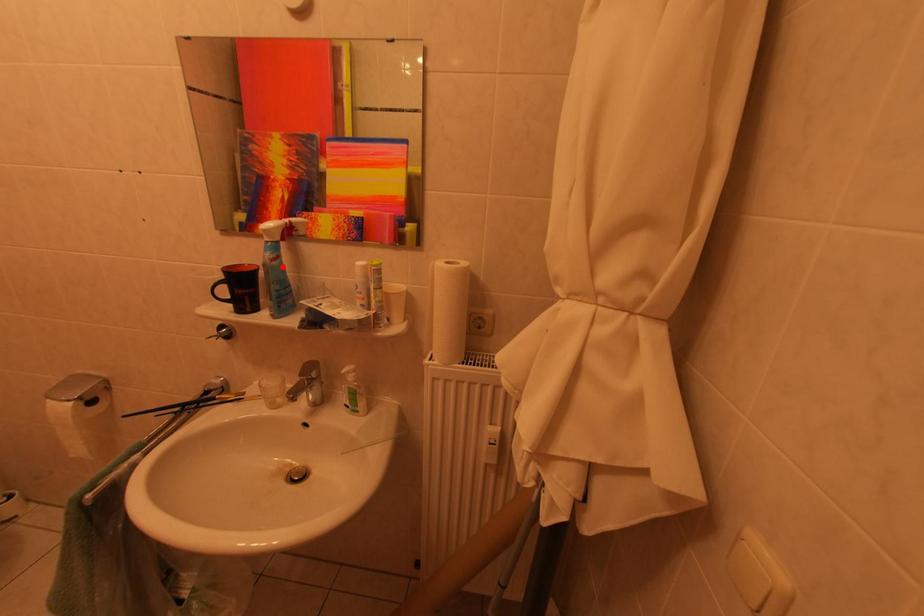
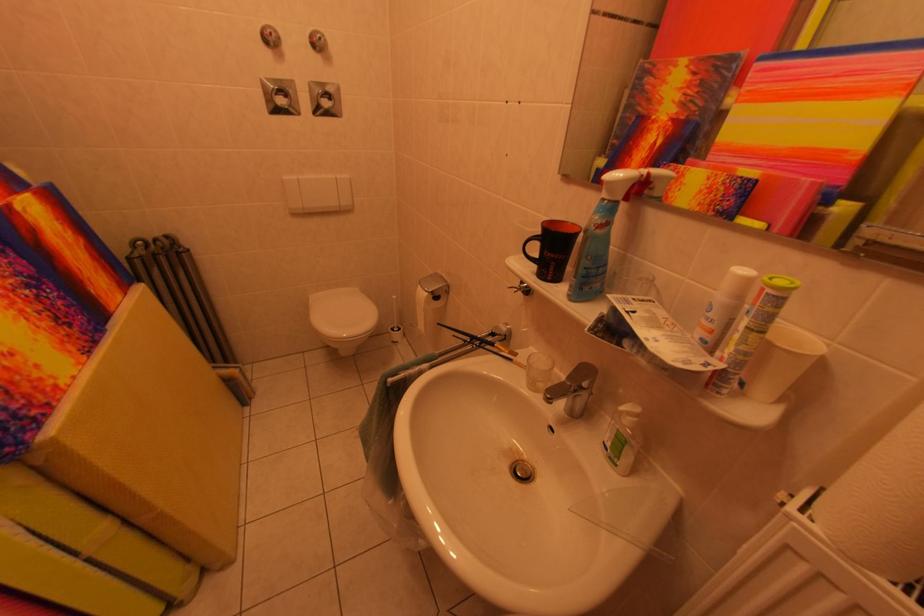
Locate, in the second image, the point that corresponds to the highlighted location in the first image.

(606, 235)